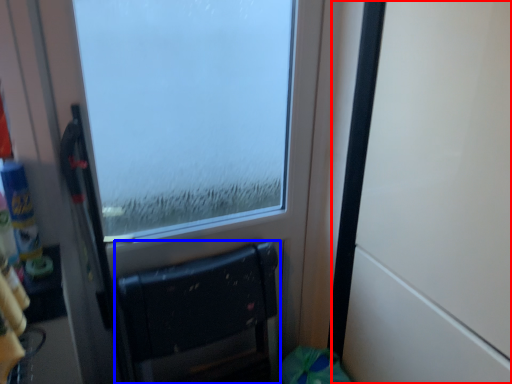
Question: Among these objects, which one is farthest to the camera, door (highlighted by a red box) or furniture (highlighted by a blue box)?

Choices:
 (A) door
 (B) furniture

Answer: (B)